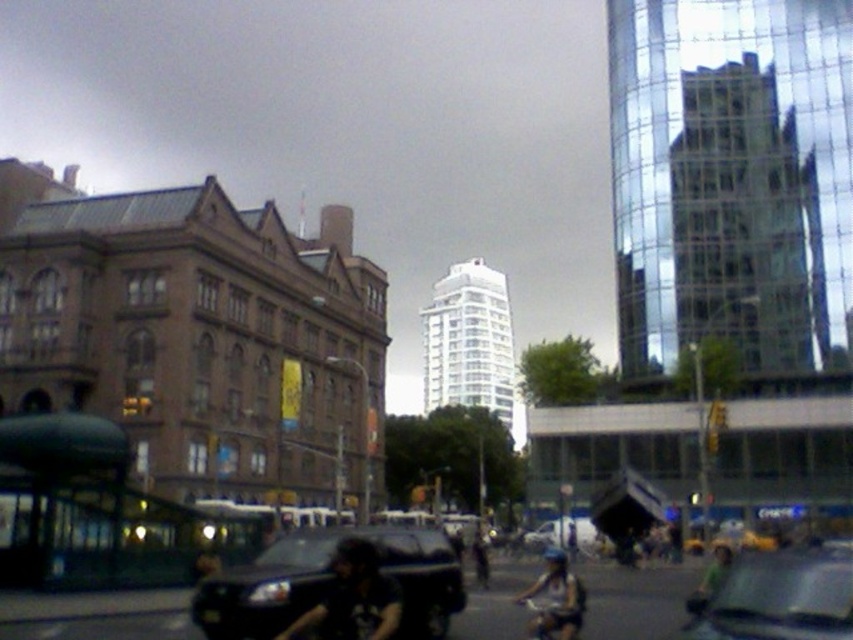
Measure the distance between point (x=323, y=627) and camera.

Point (x=323, y=627) is 36.98 meters away from camera.

Locate an element on the screen. Image resolution: width=853 pixels, height=640 pixels. dark gray helmet at center is located at coordinates (352, 600).

Between dark blue helmet at center and dark blue shirt at center, which one appears on the right side from the viewer's perspective?

Positioned to the right is dark blue helmet at center.

Who is taller, dark blue helmet at center or dark blue shirt at center?

dark blue helmet at center is taller.

Between point (537, 618) and point (480, 561), which one is positioned behind?

The point (480, 561) is behind.

Locate an element on the screen. The image size is (853, 640). dark blue helmet at center is located at coordinates tap(554, 600).

Is dark blue helmet at center bigger than green fabric bicycle at center?

Incorrect, dark blue helmet at center is not larger than green fabric bicycle at center.

Describe the element at coordinates (554, 600) in the screenshot. Image resolution: width=853 pixels, height=640 pixels. I see `dark blue helmet at center` at that location.

The image size is (853, 640). What do you see at coordinates (554, 600) in the screenshot?
I see `dark blue helmet at center` at bounding box center [554, 600].

At what (x,y) coordinates should I click in order to perform the action: click on dark blue helmet at center. Please return your answer as a coordinate pair (x, y). Looking at the image, I should click on (554, 600).